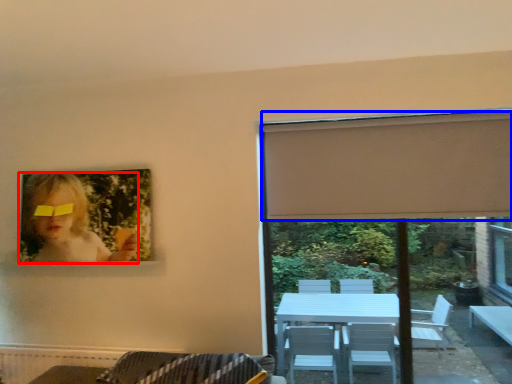
Question: Which object appears closest to the camera in this image, woman (highlighted by a red box) or curtain (highlighted by a blue box)?

Choices:
 (A) woman
 (B) curtain

Answer: (B)